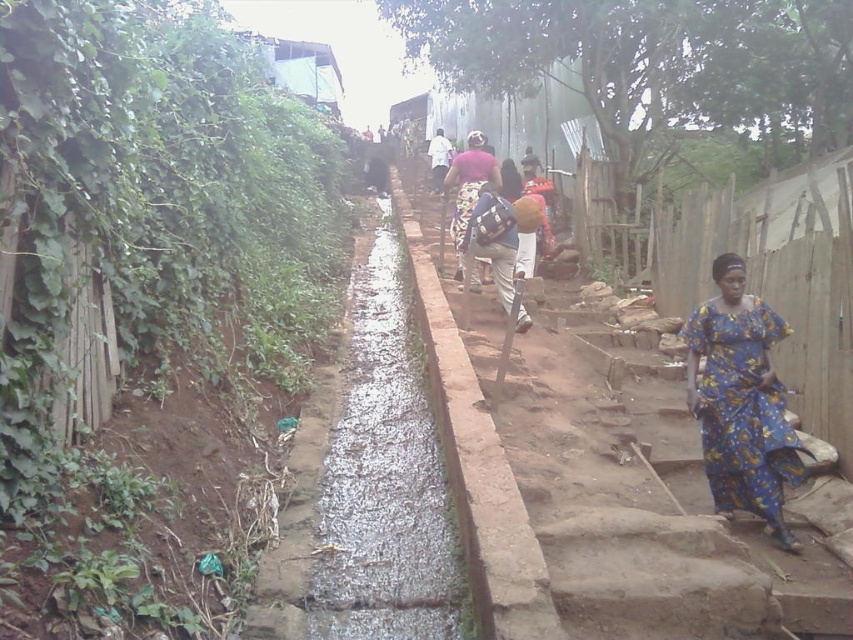
Question: Which of the following is the farthest from the observer?

Choices:
 (A) (480, 145)
 (B) (550, 561)

Answer: (A)

Question: Which object is farther from the camera taking this photo?

Choices:
 (A) blue printed fabric dress at lower right
 (B) wet concrete creek at center

Answer: (A)

Question: Which point is farther from the camera taking this photo?

Choices:
 (A) (403, 305)
 (B) (793, 314)

Answer: (A)

Question: Is the position of concrete steps at center more distant than that of wet concrete creek at center?

Choices:
 (A) no
 (B) yes

Answer: (A)

Question: Is the position of concrete steps at center less distant than that of blue printed fabric dress at lower right?

Choices:
 (A) yes
 (B) no

Answer: (A)

Question: Is blue printed fabric dress at lower right to the left of matte pink fabric at center from the viewer's perspective?

Choices:
 (A) no
 (B) yes

Answer: (A)